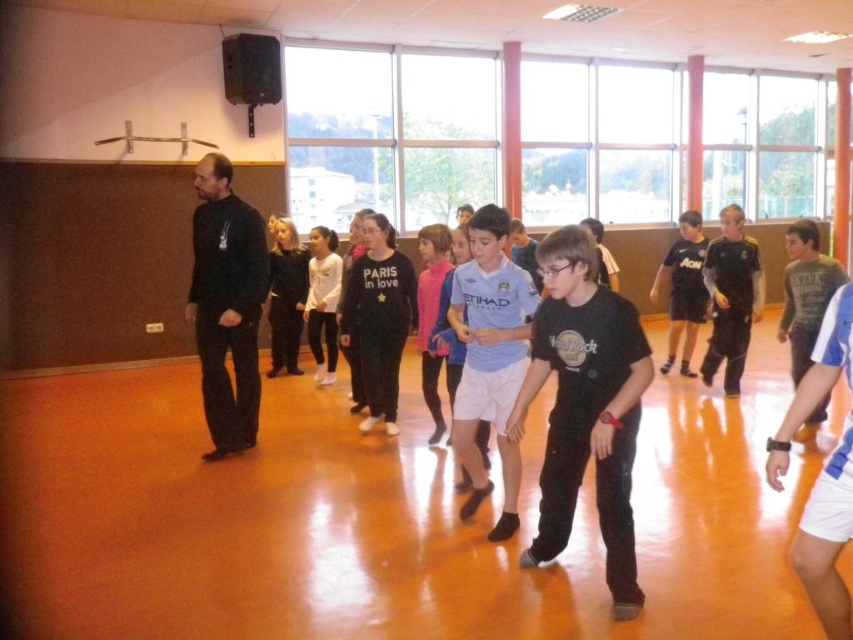
Which is below, light blue jersey at center or pink fabric shirt at center?

light blue jersey at center is below.

Can you confirm if light blue jersey at center is positioned below pink fabric shirt at center?

Yes.

I want to click on light blue jersey at center, so click(490, 356).

Who is lower down, black matte shirt at center or pink fabric shirt at center?

Positioned lower is black matte shirt at center.

Does black matte shirt at center appear over pink fabric shirt at center?

No, black matte shirt at center is not above pink fabric shirt at center.

The width and height of the screenshot is (853, 640). Describe the element at coordinates (585, 406) in the screenshot. I see `black matte shirt at center` at that location.

What are the coordinates of `black matte shirt at center` in the screenshot? It's located at (585, 406).

Does gray cotton shirt at center appear under black matte shorts at center?

Correct, gray cotton shirt at center is located below black matte shorts at center.

Is gray cotton shirt at center positioned in front of black matte shorts at center?

Yes.

This screenshot has height=640, width=853. What do you see at coordinates (805, 292) in the screenshot?
I see `gray cotton shirt at center` at bounding box center [805, 292].

At what (x,y) coordinates should I click in order to perform the action: click on gray cotton shirt at center. Please return your answer as a coordinate pair (x, y). Looking at the image, I should click on (805, 292).